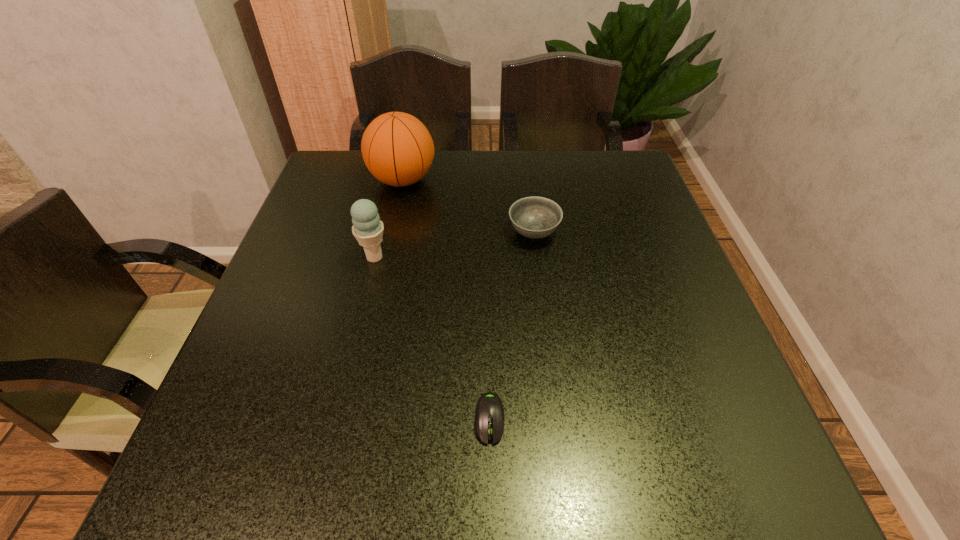
What are the coordinates of `basketball` in the screenshot? It's located at (398, 150).

I want to click on the farthest object, so click(x=398, y=150).

The image size is (960, 540). I want to click on ice cream, so click(x=367, y=228).

At what (x,y) coordinates should I click in order to perform the action: click on the rightmost object. Please return your answer as a coordinate pair (x, y). The width and height of the screenshot is (960, 540). Looking at the image, I should click on (534, 217).

Where is `bowl`? bowl is located at coordinates (534, 217).

Where is `the third object from left to right`? the third object from left to right is located at coordinates [x=489, y=413].

At what (x,y) coordinates should I click in order to perform the action: click on the nearest object. Please return your answer as a coordinate pair (x, y). The height and width of the screenshot is (540, 960). Looking at the image, I should click on (489, 413).

Identify the location of free space located on the front of the basketball. This screenshot has width=960, height=540. (391, 238).

This screenshot has height=540, width=960. I want to click on vacant space situated on the front of the second tallest object, so click(x=344, y=386).

At what (x,y) coordinates should I click in order to perform the action: click on vacant space situated on the front of the third tallest object. Please return your answer as a coordinate pair (x, y). This screenshot has height=540, width=960. Looking at the image, I should click on (553, 380).